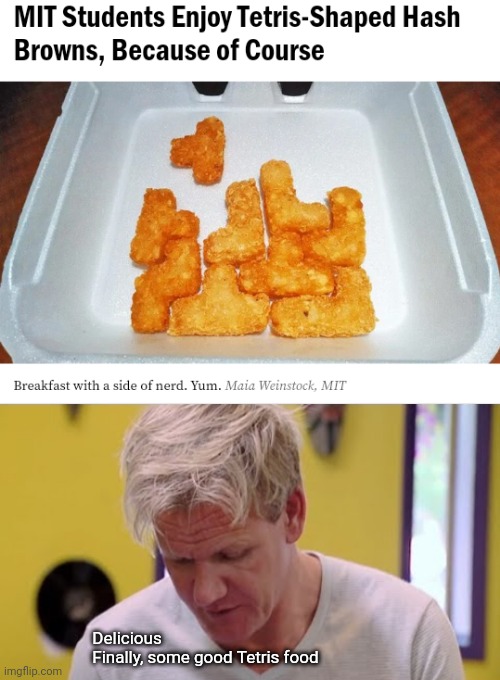
What are the coordinates of `paper tray` in the screenshot? It's located at (141, 165).